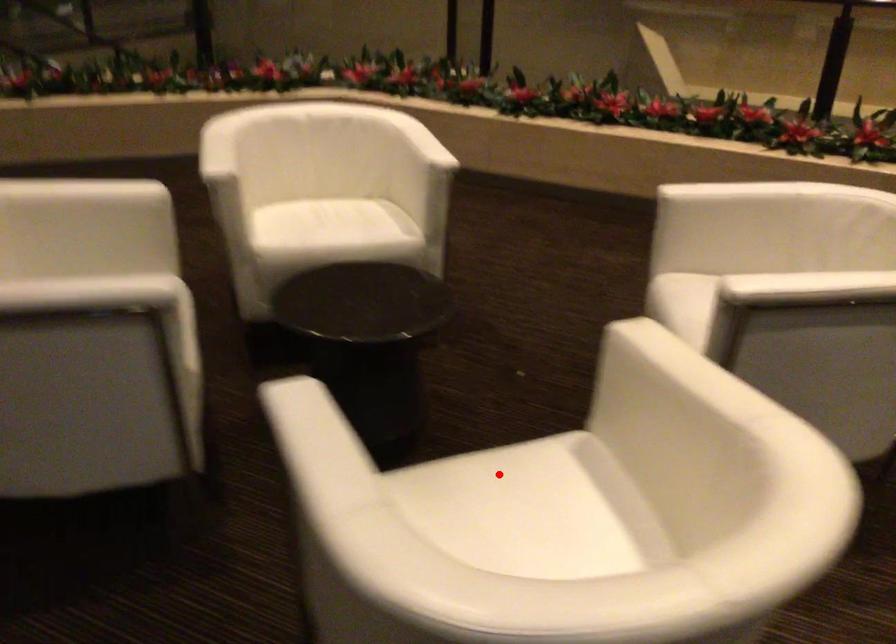
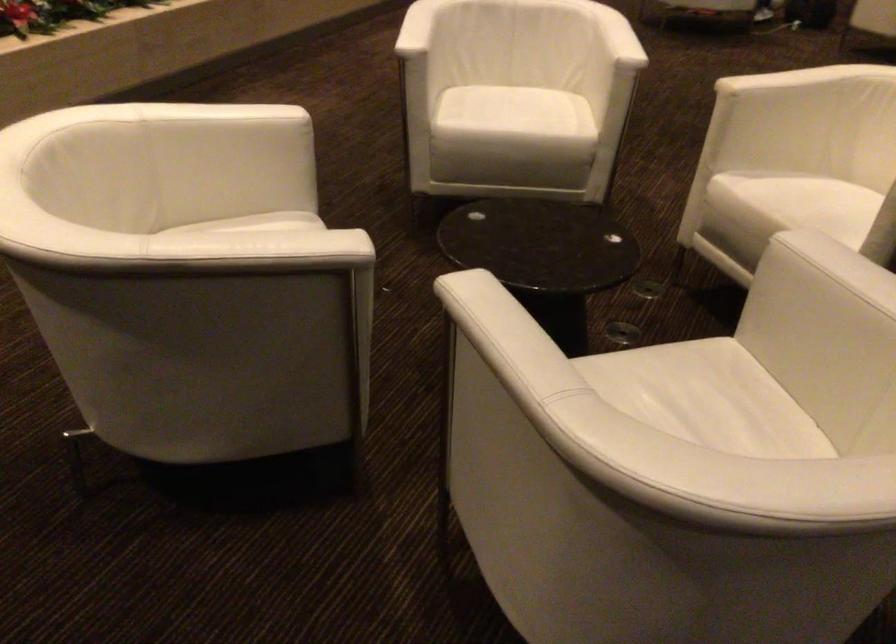
Question: A red point is marked in image1. In image2, is the corresponding 3D point closer to the camera or farther? Reply with the corresponding letter.

Choices:
 (A) The corresponding 3D point is closer.
 (B) The corresponding 3D point is farther.

Answer: (B)